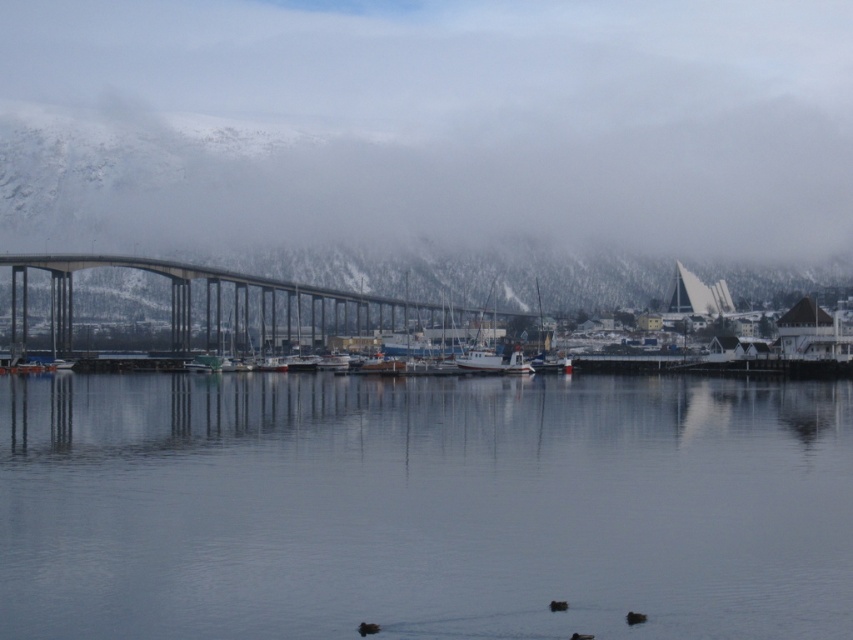
Question: Is transparent water at center positioned before concrete bridge at center?

Choices:
 (A) yes
 (B) no

Answer: (A)

Question: Can you confirm if transparent water at center is positioned below concrete bridge at center?

Choices:
 (A) yes
 (B) no

Answer: (A)

Question: Can you confirm if transparent water at center is positioned to the left of concrete bridge at center?

Choices:
 (A) yes
 (B) no

Answer: (B)

Question: Which object is closer to the camera taking this photo?

Choices:
 (A) transparent water at center
 (B) concrete bridge at center

Answer: (A)